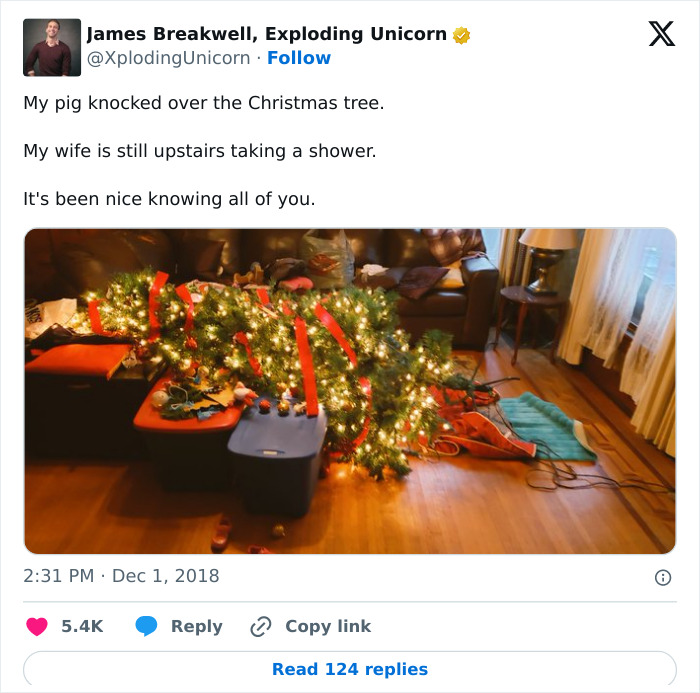
You are a GUI agent. You are given a task and a screenshot of the screen. Output one action in this format:
    pyautogui.click(x=<x>, y=<y>)
    Task: Click on the window
    The height and width of the screenshot is (693, 700).
    Given the screenshot: What is the action you would take?
    pyautogui.click(x=636, y=299)